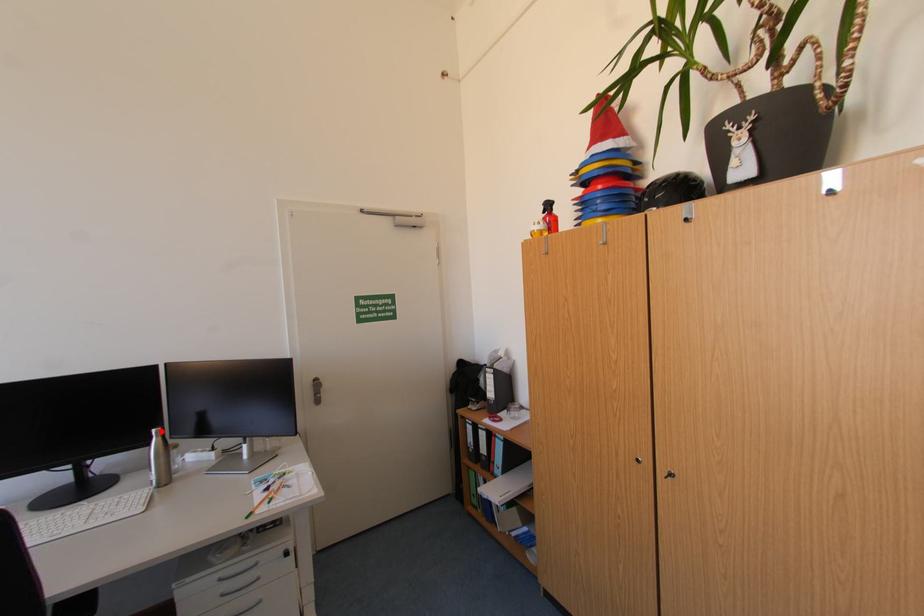
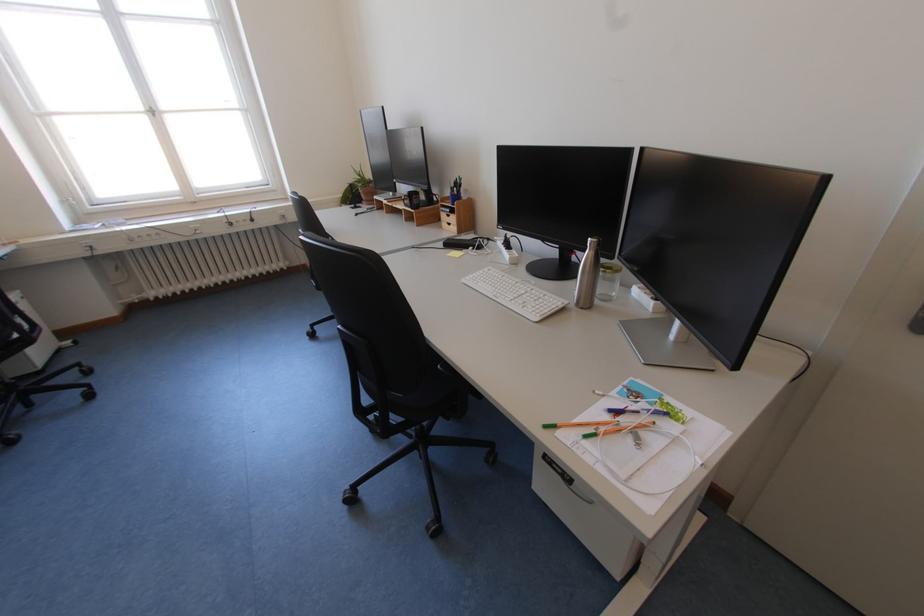
In the second image, find the point that corresponds to the highlighted location in the first image.

(599, 240)